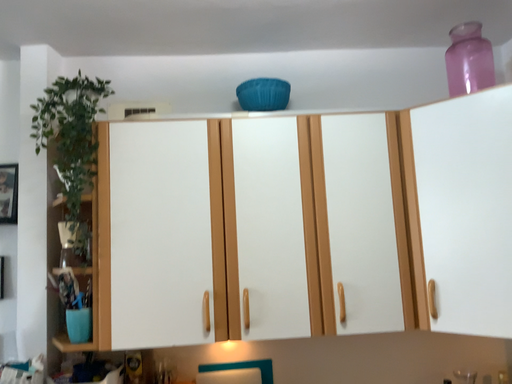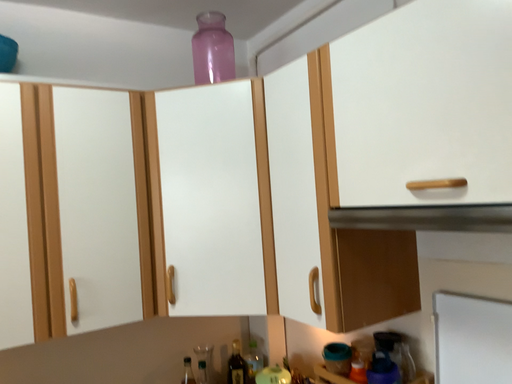
Question: How did the camera likely rotate when shooting the video?

Choices:
 (A) rotated left
 (B) rotated right

Answer: (B)